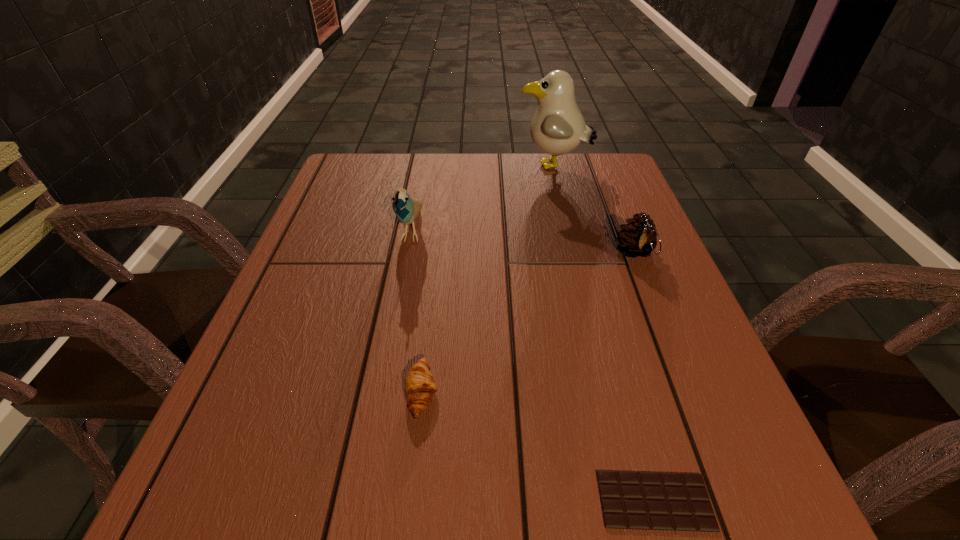
Locate which object is the fourth closest to the leftmost object. Please provide its 2D coordinates. Your answer should be formatted as a tuple, i.e. [(x, y)], where the tuple contains the x and y coordinates of a point satisfying the conditions above.

[(630, 500)]

This screenshot has height=540, width=960. I want to click on free space that satisfies the following two spatial constraints: 1. on the beak of the farthest object; 2. at the face of the leftmost object, so click(x=569, y=230).

I want to click on vacant point that satisfies the following two spatial constraints: 1. with a leaf charm attached to the pinecone; 2. on the front-facing side of the fourth farthest object, so click(690, 393).

Where is `blank space that satisfies the following two spatial constraints: 1. on the front-facing side of the second shortest object; 2. on the back side of the shortest object`? Image resolution: width=960 pixels, height=540 pixels. blank space that satisfies the following two spatial constraints: 1. on the front-facing side of the second shortest object; 2. on the back side of the shortest object is located at coordinates (410, 501).

What are the coordinates of `free region that satisfies the following two spatial constraints: 1. on the beak of the shortest object; 2. on the left side of the gull` in the screenshot? It's located at (635, 501).